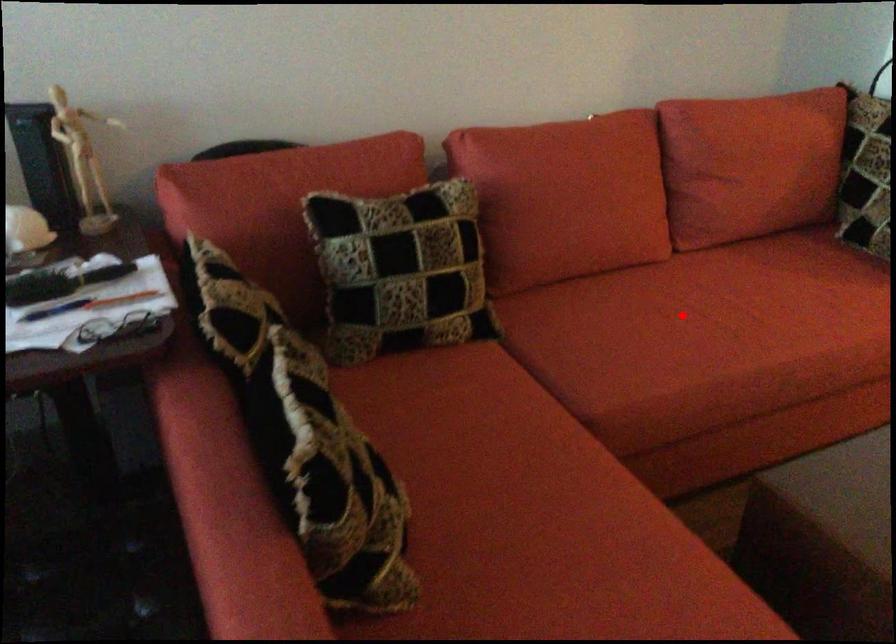
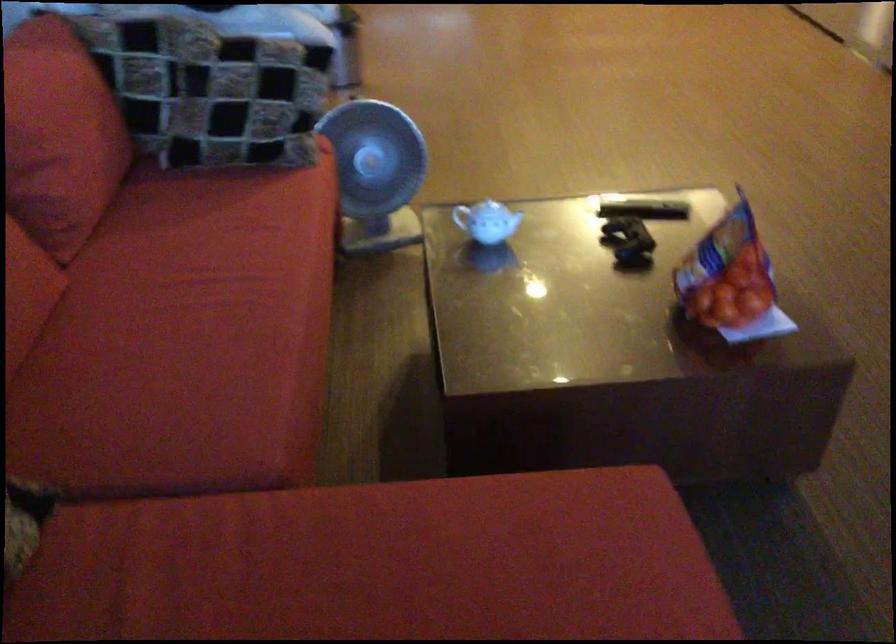
Find the pixel in the second image that matches the highlighted location in the first image.

(192, 330)